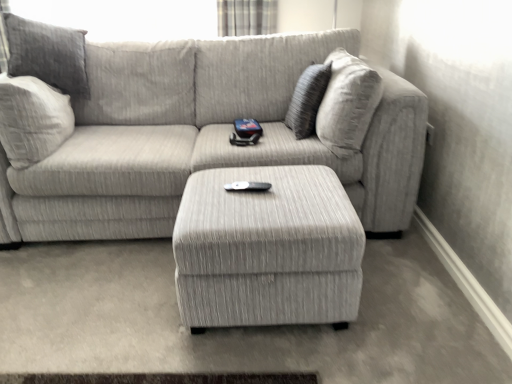
Question: In terms of height, does plaid fabric curtain at upper center look taller or shorter compared to textured gray ottoman at center?

Choices:
 (A) tall
 (B) short

Answer: (B)

Question: Considering the relative positions of plaid fabric curtain at upper center and textured gray ottoman at center in the image provided, is plaid fabric curtain at upper center to the left or to the right of textured gray ottoman at center?

Choices:
 (A) right
 (B) left

Answer: (B)

Question: Considering the real-world distances, which object is farthest from the textured gray ottoman at center?

Choices:
 (A) beige fabric pillow at upper right
 (B) plaid fabric curtain at upper center
 (C) textured gray couch at center

Answer: (B)

Question: Which is farther from the textured gray couch at center?

Choices:
 (A) plaid fabric curtain at upper center
 (B) textured gray ottoman at center
 (C) beige fabric pillow at upper right

Answer: (A)